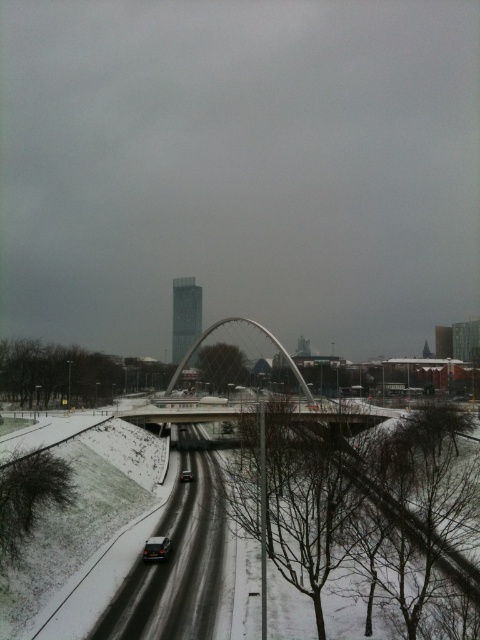
How far apart are glassy steel bridge at center and dark gray metallic car at lower center?

A distance of 196.03 feet exists between glassy steel bridge at center and dark gray metallic car at lower center.

Is glassy steel bridge at center closer to the viewer compared to dark gray metallic car at lower center?

Yes.

Identify the location of glassy steel bridge at center. [x=210, y=397].

From the picture: Who is more distant from viewer, (193, 547) or (132, 404)?

The point (132, 404) is more distant.

Between black asphalt road at lower center and glassy steel bridge at center, which one has more height?

With more height is glassy steel bridge at center.

This screenshot has height=640, width=480. In order to click on black asphalt road at lower center in this screenshot , I will do `click(178, 561)`.

Which is more to the left, concrete bridge at center or glassy steel bridge at center?

From the viewer's perspective, glassy steel bridge at center appears more on the left side.

Where is `concrete bridge at center`? The height and width of the screenshot is (640, 480). concrete bridge at center is located at coordinates (184, 413).

Find the location of a particular element. The height and width of the screenshot is (640, 480). concrete bridge at center is located at coordinates (184, 413).